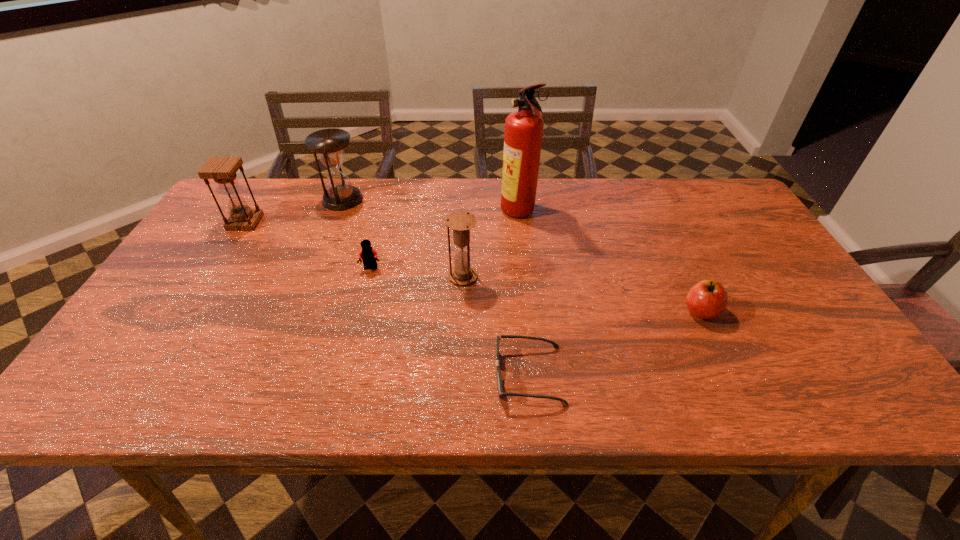
Where is `vacant space at the near right corner of the desktop`? This screenshot has height=540, width=960. vacant space at the near right corner of the desktop is located at coordinates (836, 382).

Find the location of a particular element. The width and height of the screenshot is (960, 540). empty space between the spectacles and the second farthest hourglass is located at coordinates pyautogui.click(x=387, y=299).

The height and width of the screenshot is (540, 960). I want to click on vacant area between the Lego and the rightmost hourglass, so click(417, 272).

Identify the location of vacant point located between the sixth object from right to left and the rightmost hourglass. This screenshot has height=540, width=960. (403, 238).

Locate an element on the screen. The image size is (960, 540). vacant region between the third object from left to right and the rightmost object is located at coordinates (536, 289).

Locate an element on the screen. The image size is (960, 540). vacant area that lies between the fire extinguisher and the fourth object from left to right is located at coordinates (492, 245).

I want to click on unoccupied area between the fire extinguisher and the nearest hourglass, so click(x=492, y=245).

I want to click on free space that is in between the second farthest hourglass and the farthest hourglass, so click(x=294, y=211).

Find the location of a particular element. The height and width of the screenshot is (540, 960). vacant region between the Lego and the nearest hourglass is located at coordinates (417, 272).

Find the location of a particular element. free space between the rightmost object and the shortest object is located at coordinates (614, 343).